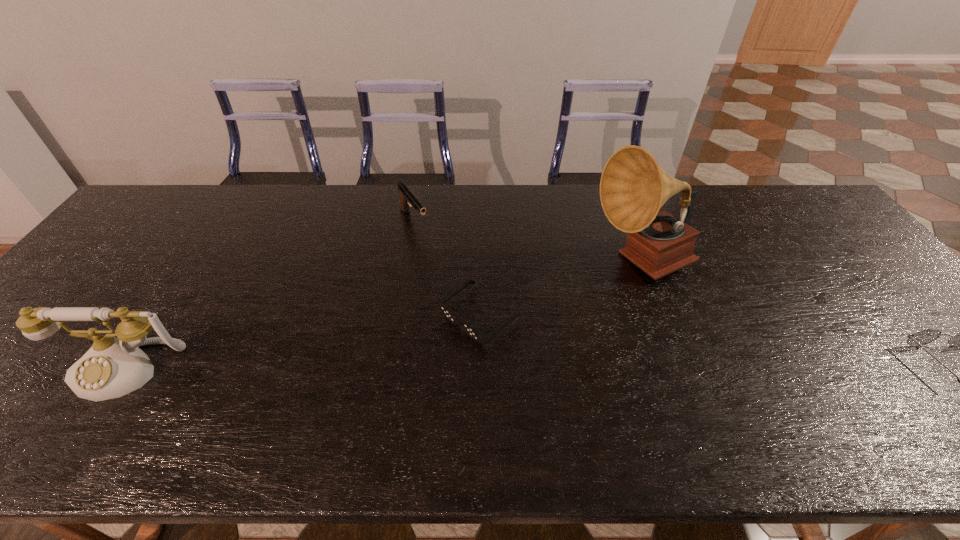
Image resolution: width=960 pixels, height=540 pixels. I want to click on the fourth shortest object, so click(113, 367).

This screenshot has width=960, height=540. I want to click on the leftmost object, so click(113, 367).

What are the coordinates of `the fourth object from right to left` in the screenshot? It's located at (407, 198).

I want to click on the third shortest object, so click(407, 198).

Locate an element on the screen. The image size is (960, 540). phonograph record is located at coordinates (633, 188).

At what (x,y) coordinates should I click in order to perform the action: click on the fourth object from left to right. Please return your answer as a coordinate pair (x, y). The width and height of the screenshot is (960, 540). Looking at the image, I should click on (633, 188).

Locate an element on the screen. The image size is (960, 540). the third object from right to left is located at coordinates (477, 335).

Locate an element on the screen. This screenshot has width=960, height=540. the shortest object is located at coordinates (477, 335).

At what (x,y) coordinates should I click in order to perform the action: click on vacant space located at the muzzle of the pistol. Please return your answer as a coordinate pair (x, y). Looking at the image, I should click on (476, 308).

The width and height of the screenshot is (960, 540). Identify the location of free space located 0.200m at the muzzle of the pistol. (451, 275).